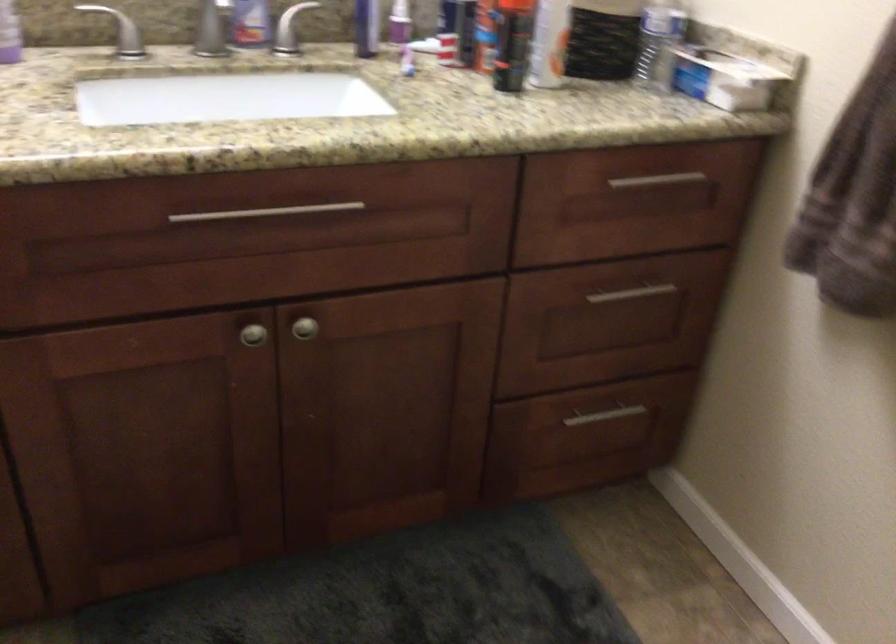
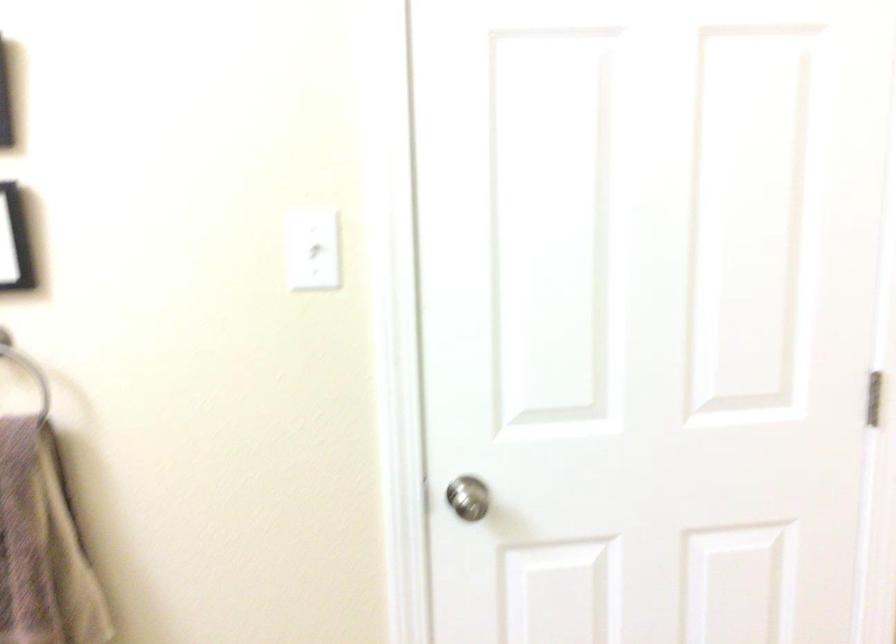
Question: How did the camera likely rotate?

Choices:
 (A) Left
 (B) Right
 (C) Up
 (D) Down

Answer: (B)